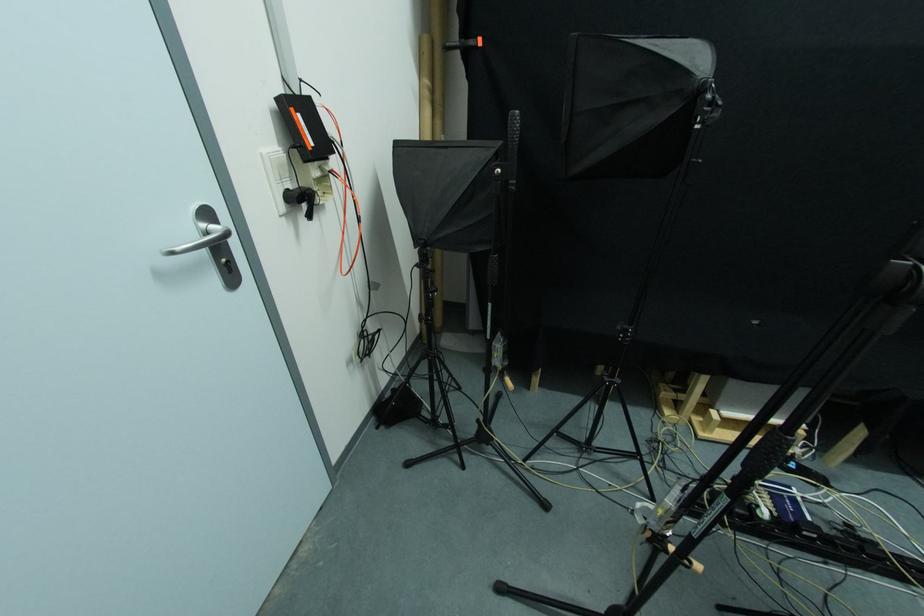
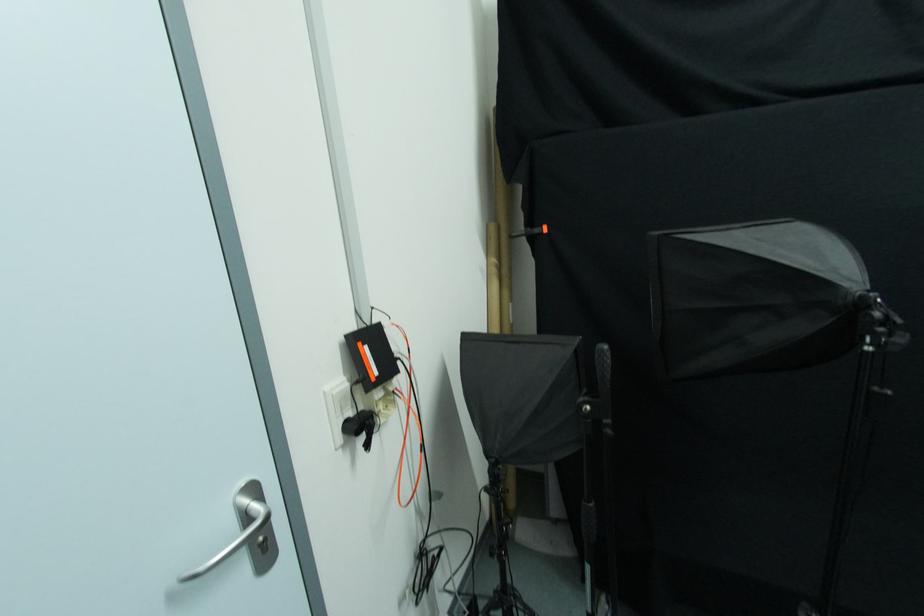
Question: In a continuous first-person perspective shot, in which direction is the camera moving?

Choices:
 (A) Left
 (B) Right
 (C) Forward
 (D) Backward

Answer: (C)